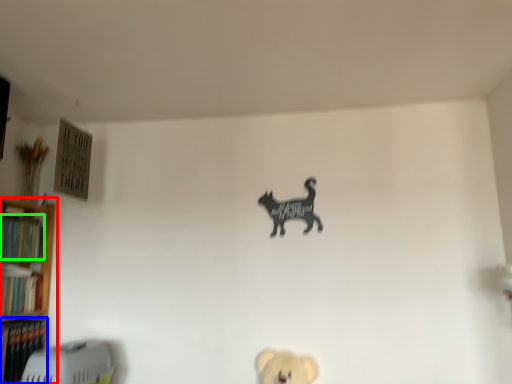
Question: Estimate the real-world distances between objects in this image. Which object is closer to shelf (highlighted by a red box), book (highlighted by a blue box) or book (highlighted by a green box)?

Choices:
 (A) book
 (B) book

Answer: (B)